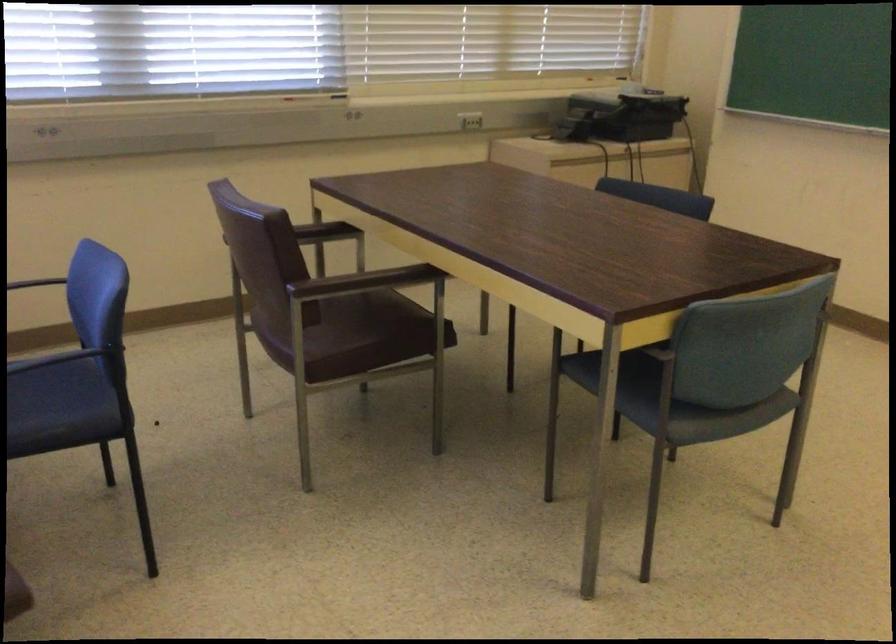
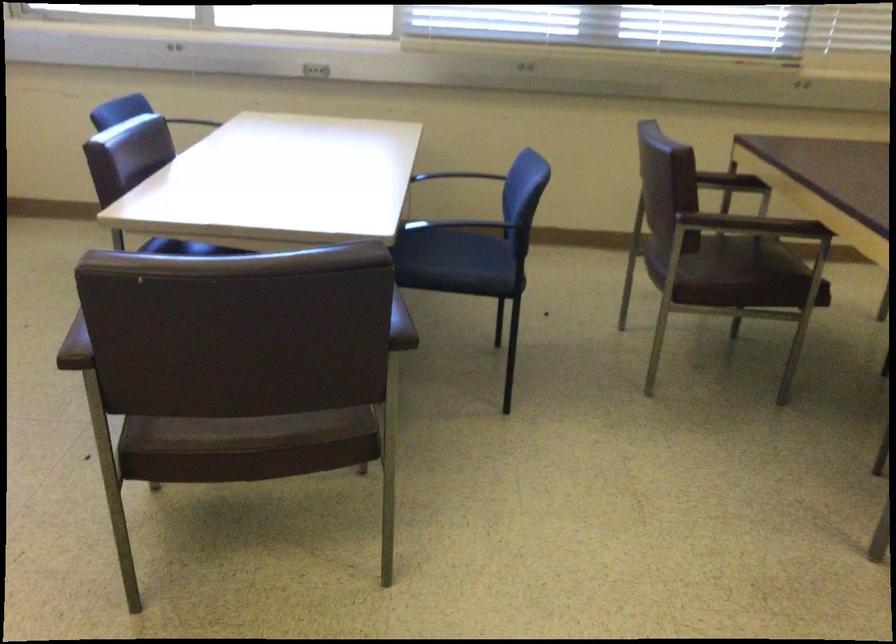
The point at (322, 236) is marked in the first image. Where is the corresponding point in the second image?

(730, 182)